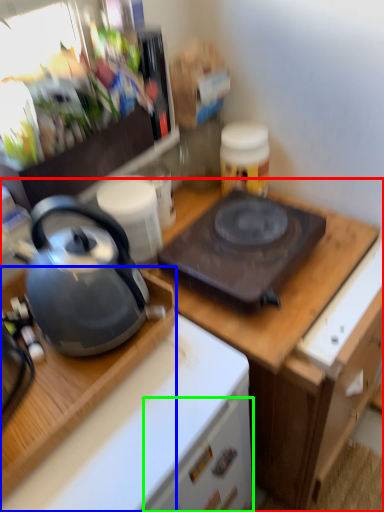
Question: Considering the real-world distances, which object is closest to cabinetry (highlighted by a red box)? desk (highlighted by a blue box) or drawer (highlighted by a green box).

Choices:
 (A) desk
 (B) drawer

Answer: (B)